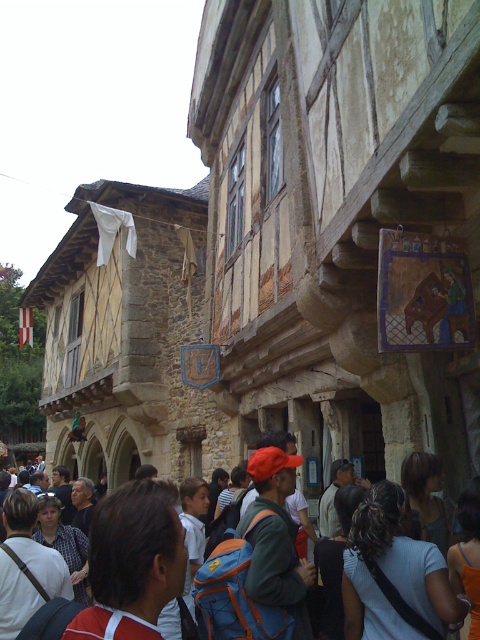
You are a visitor standing in front of the historic building. You notice two items in the scene. One is curly hair at center and the other is orange fabric shirt at lower right. Which of these two items is taller?

The curly hair at center is taller than the orange fabric shirt at lower right according to the description.

You are a visitor in this historic setting and notice two shirts in the scene. The orange fabric shirt at lower right and the plaid shirt at center. Which shirt is positioned higher from the ground?

The orange fabric shirt at lower right is positioned higher from the ground than the plaid shirt at center because it is above it.

You are a tailor observing two shirts in the scene. The orange fabric shirt at lower right and the brown fabric shirt at center. Which shirt is shorter in length?

The orange fabric shirt at lower right is shorter than the brown fabric shirt at center.